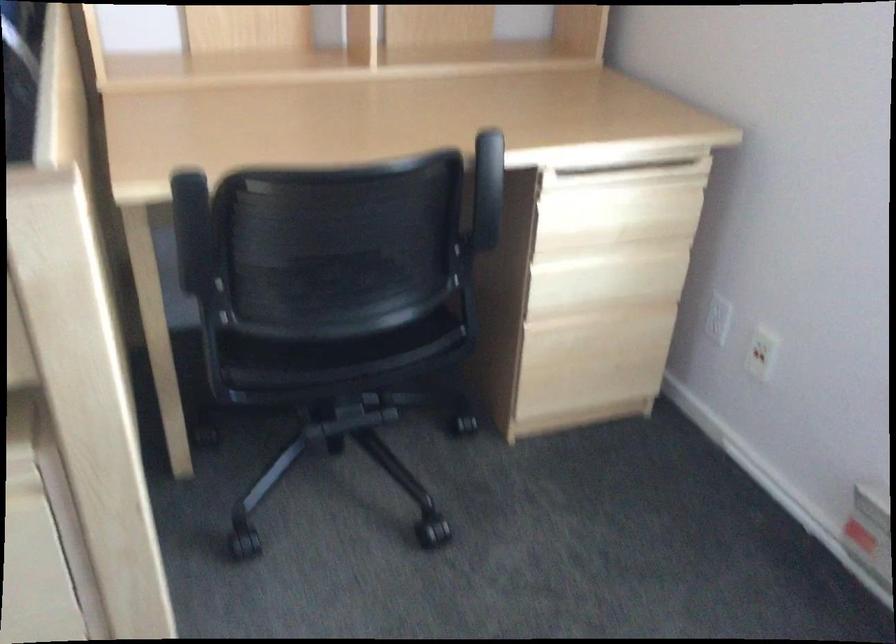
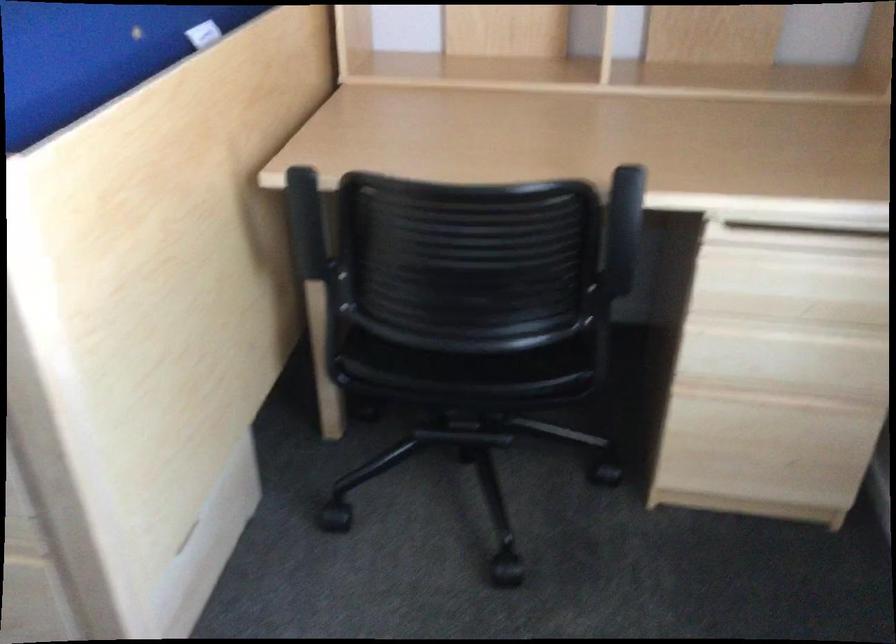
The images are taken continuously from a first-person perspective. In which direction are you moving?

The cameraman walked toward right, forward.